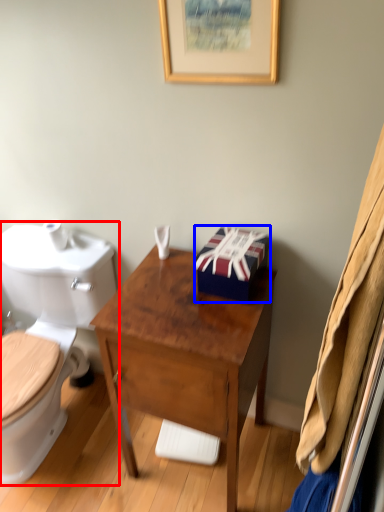
Question: Which object is further to the camera taking this photo, toilet (highlighted by a red box) or box (highlighted by a blue box)?

Choices:
 (A) toilet
 (B) box

Answer: (B)